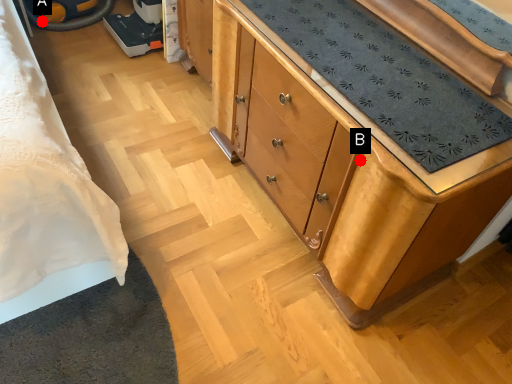
Question: Two points are circled on the image, labeled by A and B beside each circle. Which point is closer to the camera?

Choices:
 (A) A is closer
 (B) B is closer

Answer: (B)